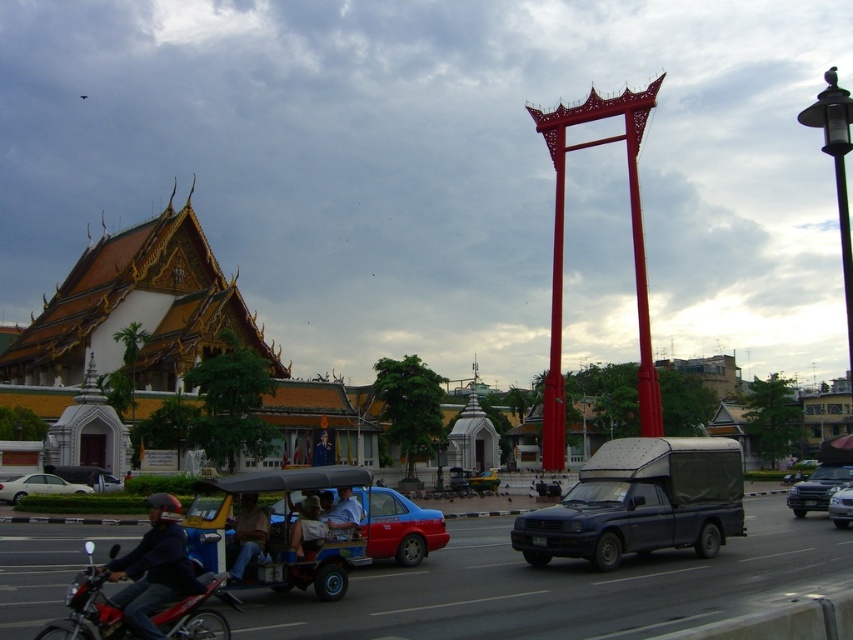
Is dark gray matte truck at center bigger than black metal/texture streetlamp at upper right?

No, dark gray matte truck at center is not bigger than black metal/texture streetlamp at upper right.

Who is more forward, (723, 528) or (814, 106)?

Point (814, 106) is in front.

Where is `dark gray matte truck at center`? This screenshot has width=853, height=640. dark gray matte truck at center is located at coordinates (640, 502).

Is metallic red motorcycle at lower left bigger than metallic blue taxi at center?

Correct, metallic red motorcycle at lower left is larger in size than metallic blue taxi at center.

Between metallic red motorcycle at lower left and metallic blue taxi at center, which one has more height?

metallic red motorcycle at lower left

Find the location of a particular element. metallic red motorcycle at lower left is located at coordinates (138, 608).

You are a GUI agent. You are given a task and a screenshot of the screen. Output one action in this format:
    pyautogui.click(x=<x>, y=<y>)
    Task: Click on the metallic red motorcycle at lower left
    This screenshot has width=853, height=640.
    Given the screenshot: What is the action you would take?
    pyautogui.click(x=138, y=608)

Is metallic blue taxi at center smaller than metallic silver car at center?

Incorrect, metallic blue taxi at center is not smaller in size than metallic silver car at center.

Does point (383, 554) come farther from viewer compared to point (833, 497)?

No.

The height and width of the screenshot is (640, 853). Find the location of `metallic blue taxi at center`. metallic blue taxi at center is located at coordinates (398, 525).